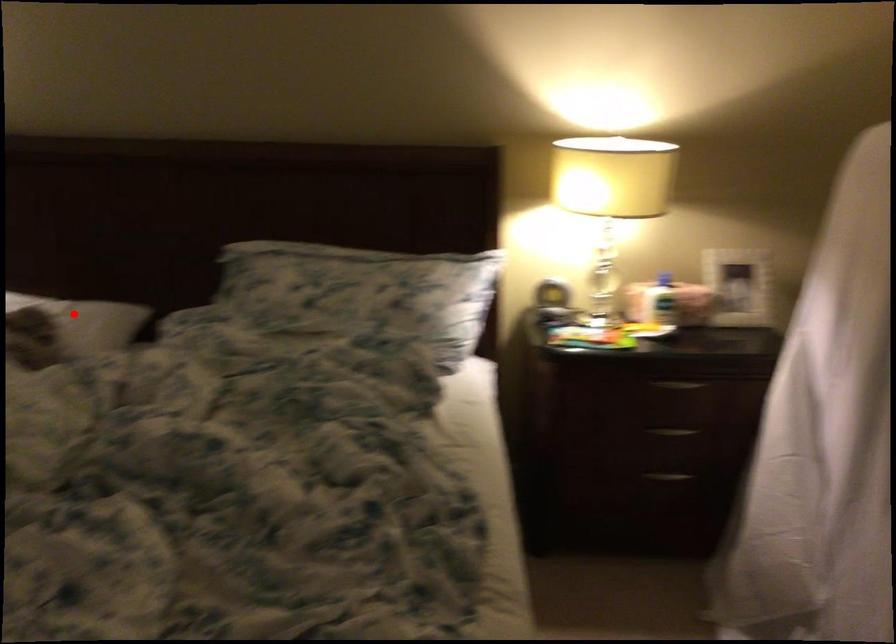
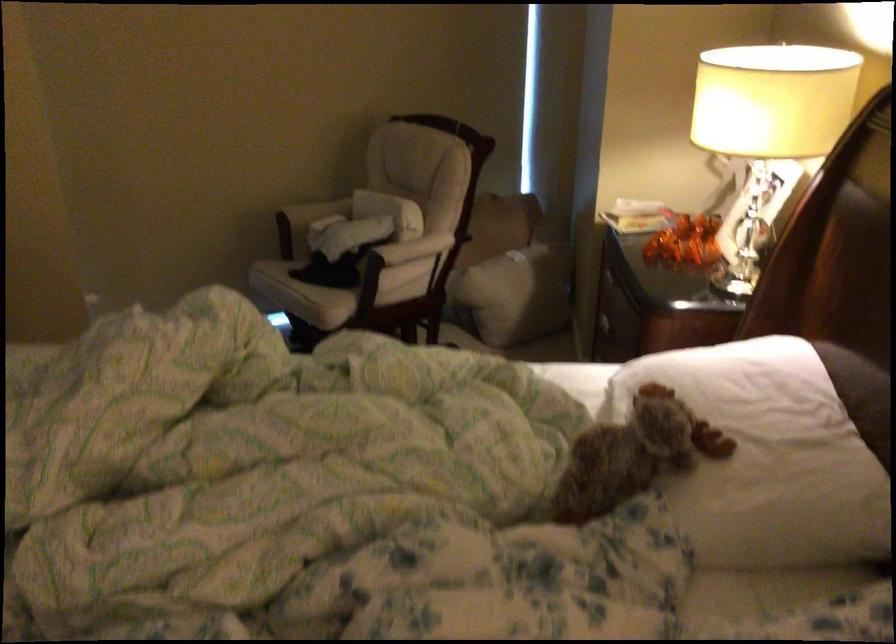
Locate, in the second image, the point that corresponds to the highlighted location in the first image.

(767, 458)